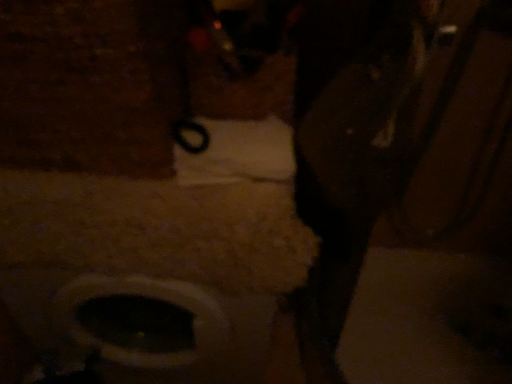
Measure the distance between point (258, 273) and camera.

Point (258, 273) is 32.48 inches from camera.

What do you see at coordinates (161, 254) in the screenshot? Image resolution: width=512 pixels, height=384 pixels. I see `white matte toilet at center` at bounding box center [161, 254].

This screenshot has width=512, height=384. I want to click on white matte toilet at center, so click(161, 254).

What is the approximate width of white matte toilet at center?

48.43 centimeters.

You are a GUI agent. You are given a task and a screenshot of the screen. Output one action in this format:
    pyautogui.click(x=<x>, y=<y>)
    Task: Click on the white matte toilet at center
    
    Given the screenshot: What is the action you would take?
    [x=161, y=254]